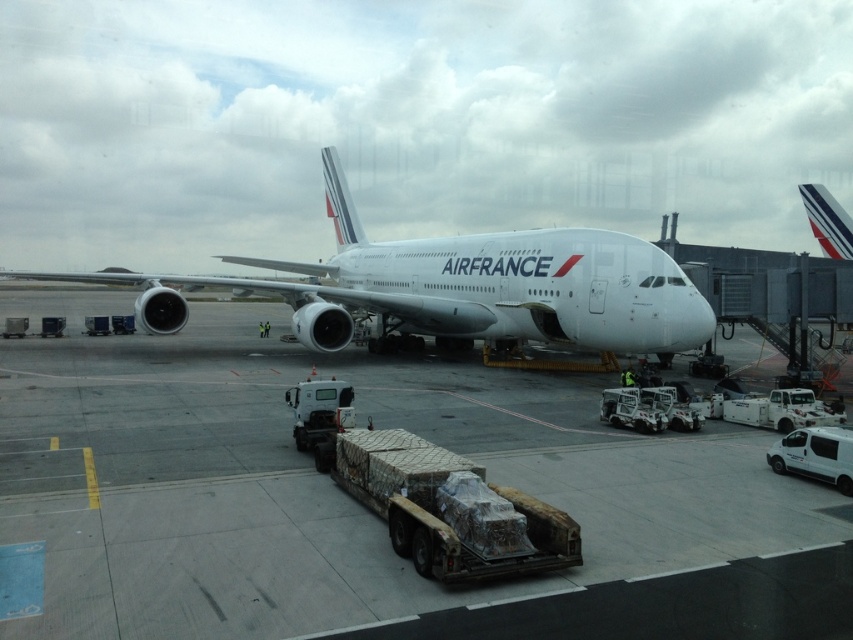
Question: Can you confirm if white concrete tarmac at center is bigger than white metallic airplane at center?

Choices:
 (A) yes
 (B) no

Answer: (B)

Question: Which of the following is the closest to the observer?

Choices:
 (A) (639, 260)
 (B) (397, 588)

Answer: (B)

Question: Observing the image, what is the correct spatial positioning of white concrete tarmac at center in reference to white metallic airplane at center?

Choices:
 (A) left
 (B) right

Answer: (B)

Question: Based on their relative distances, which object is farther from the white glossy airplane at upper center?

Choices:
 (A) white metallic airplane at center
 (B) white concrete tarmac at center

Answer: (A)

Question: Which point is closer to the camera?

Choices:
 (A) white glossy airplane at upper center
 (B) white metallic airplane at center

Answer: (B)

Question: Does white concrete tarmac at center have a greater width compared to white metallic airplane at center?

Choices:
 (A) no
 (B) yes

Answer: (A)